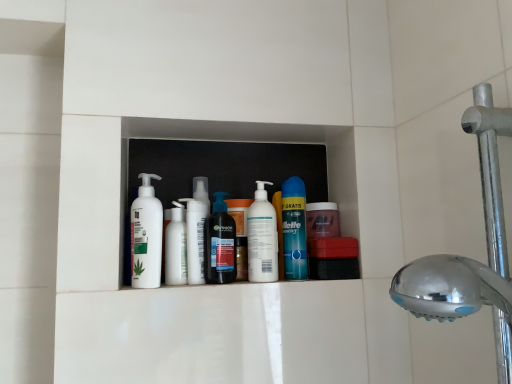
Describe the element at coordinates (262, 238) in the screenshot. I see `white matte pump bottle at center, acting as the 4th cleaning product starting from the left` at that location.

Image resolution: width=512 pixels, height=384 pixels. What are the coordinates of `white matte pump bottle at center, which is counted as the 2th cleaning product, starting from the right` in the screenshot? It's located at (262, 238).

The width and height of the screenshot is (512, 384). What do you see at coordinates (176, 247) in the screenshot? I see `white glossy lotion at center` at bounding box center [176, 247].

Describe the element at coordinates (195, 240) in the screenshot. I see `white matte bottle at center, the fourth cleaning product from the right` at that location.

Locate an element on the screen. chrome metallic shower head at right is located at coordinates pyautogui.click(x=465, y=257).

Locate an element on the screen. The height and width of the screenshot is (384, 512). white matte lotion at center, acting as the first cleaning product starting from the left is located at coordinates (146, 236).

The height and width of the screenshot is (384, 512). Identify the location of cleaning product that is the 4th one when counting upward from the white glossy lotion at center (from the image's perspective). (294, 229).

From the image's perspective, is white glossy lotion at center above blue glossy can at center, marked as the 1th cleaning product in a right-to-left arrangement?

Incorrect, from the image's perspective, white glossy lotion at center is lower than blue glossy can at center, marked as the 1th cleaning product in a right-to-left arrangement.

Could you tell me if white glossy lotion at center is facing blue glossy can at center, which ranks as the fifth cleaning product in left-to-right order?

No.

Considering the relative sizes of white matte lotion at center, acting as the first cleaning product starting from the left, and white glossy lotion at center in the image provided, is white matte lotion at center, acting as the first cleaning product starting from the left, smaller than white glossy lotion at center?

No, white matte lotion at center, acting as the first cleaning product starting from the left, is not smaller than white glossy lotion at center.

Which of these two, white matte lotion at center, acting as the 5th cleaning product starting from the right, or white glossy lotion at center, stands taller?

white matte lotion at center, acting as the 5th cleaning product starting from the right.

Which object is thinner, white matte lotion at center, acting as the first cleaning product starting from the left, or white glossy lotion at center?

Thinner between the two is white glossy lotion at center.

Are blue glossy can at center, which ranks as the fifth cleaning product in left-to-right order, and white matte bottle at center, the fourth cleaning product from the right, making contact?

No, blue glossy can at center, which ranks as the fifth cleaning product in left-to-right order, is not with white matte bottle at center, the fourth cleaning product from the right.

From the image's perspective, starting from the blue glossy can at center, marked as the 1th cleaning product in a right-to-left arrangement, which cleaning product is the 3rd one below? Please provide its 2D coordinates.

[(195, 240)]

Does blue glossy can at center, marked as the 1th cleaning product in a right-to-left arrangement, have a greater height compared to white matte bottle at center, positioned as the 2th cleaning product in left-to-right order?

Correct, blue glossy can at center, marked as the 1th cleaning product in a right-to-left arrangement, is much taller as white matte bottle at center, positioned as the 2th cleaning product in left-to-right order.

Is white glossy lotion at center to the left or to the right of white matte lotion at center, acting as the first cleaning product starting from the left, in the image?

In the image, white glossy lotion at center appears on the right side of white matte lotion at center, acting as the first cleaning product starting from the left.

From the image's perspective, which is above, white glossy lotion at center or white matte lotion at center, acting as the first cleaning product starting from the left?

From the image's view, white matte lotion at center, acting as the first cleaning product starting from the left, is above.

From a real-world perspective, is white glossy lotion at center physically located above or below white matte lotion at center, acting as the first cleaning product starting from the left?

In terms of real-world spatial position, white glossy lotion at center is below white matte lotion at center, acting as the first cleaning product starting from the left.

From the image's perspective, between blue glossy can at center, marked as the 1th cleaning product in a right-to-left arrangement, and white matte lotion at center, acting as the first cleaning product starting from the left, who is located below?

blue glossy can at center, marked as the 1th cleaning product in a right-to-left arrangement, is shown below in the image.

Does blue glossy can at center, marked as the 1th cleaning product in a right-to-left arrangement, lie behind white matte lotion at center, acting as the first cleaning product starting from the left?

Yes, blue glossy can at center, marked as the 1th cleaning product in a right-to-left arrangement, is behind white matte lotion at center, acting as the first cleaning product starting from the left.

From the white matte lotion at center, acting as the first cleaning product starting from the left, count 4th cleaning products backward and point to it. Please provide its 2D coordinates.

[(294, 229)]

Which of these two, blue glossy can at center, marked as the 1th cleaning product in a right-to-left arrangement, or white matte lotion at center, acting as the first cleaning product starting from the left, is thinner?

With smaller width is blue glossy can at center, marked as the 1th cleaning product in a right-to-left arrangement.

Is white matte bottle at center, the fourth cleaning product from the right, at the left side of blue glossy can at center, which ranks as the fifth cleaning product in left-to-right order?

Correct, you'll find white matte bottle at center, the fourth cleaning product from the right, to the left of blue glossy can at center, which ranks as the fifth cleaning product in left-to-right order.

Is white matte bottle at center, the fourth cleaning product from the right, turned away from blue glossy can at center, which ranks as the fifth cleaning product in left-to-right order?

No, white matte bottle at center, the fourth cleaning product from the right, is not facing the opposite direction of blue glossy can at center, which ranks as the fifth cleaning product in left-to-right order.

Identify the location of the 3rd cleaning product below the blue glossy can at center, marked as the 1th cleaning product in a right-to-left arrangement (from a real-world perspective). This screenshot has height=384, width=512. (195, 240).

From a real-world perspective, is white matte bottle at center, positioned as the 2th cleaning product in left-to-right order, on blue glossy can at center, marked as the 1th cleaning product in a right-to-left arrangement?

No, from a real-world perspective, white matte bottle at center, positioned as the 2th cleaning product in left-to-right order, is not above blue glossy can at center, marked as the 1th cleaning product in a right-to-left arrangement.

How many degrees apart are the facing directions of translucent plastic bottle at center, which is the 3th cleaning product in right-to-left order, and white matte lotion at center, acting as the 5th cleaning product starting from the right?

There is a 4.24-degree angle between the facing directions of translucent plastic bottle at center, which is the 3th cleaning product in right-to-left order, and white matte lotion at center, acting as the 5th cleaning product starting from the right.

Does translucent plastic bottle at center, which is the 3th cleaning product in right-to-left order, have a lesser height compared to white matte lotion at center, acting as the first cleaning product starting from the left?

Indeed, translucent plastic bottle at center, which is the 3th cleaning product in right-to-left order, has a lesser height compared to white matte lotion at center, acting as the first cleaning product starting from the left.

Does translucent plastic bottle at center, which is the 3th cleaning product in right-to-left order, have a lesser width compared to white matte lotion at center, acting as the 5th cleaning product starting from the right?

Correct, the width of translucent plastic bottle at center, which is the 3th cleaning product in right-to-left order, is less than that of white matte lotion at center, acting as the 5th cleaning product starting from the right.

Is translucent plastic bottle at center, which is the 3th cleaning product in right-to-left order, oriented towards white matte lotion at center, acting as the 5th cleaning product starting from the right?

No, translucent plastic bottle at center, which is the 3th cleaning product in right-to-left order, does not turn towards white matte lotion at center, acting as the 5th cleaning product starting from the right.

From the image's perspective, count 4th cleaning products upward from the white glossy lotion at center and point to it. Please provide its 2D coordinates.

[(294, 229)]

The height and width of the screenshot is (384, 512). I want to click on the 4th cleaning product in front of the white glossy lotion at center, so tap(146, 236).

Based on their spatial positions, is chrome metallic shower head at right or blue glossy can at center, marked as the 1th cleaning product in a right-to-left arrangement, further from white matte pump bottle at center, which is counted as the 2th cleaning product, starting from the right?

Among the two, chrome metallic shower head at right is located further to white matte pump bottle at center, which is counted as the 2th cleaning product, starting from the right.

Estimate the real-world distances between objects in this image. Which object is closer to white matte bottle at center, positioned as the 2th cleaning product in left-to-right order, translucent plastic bottle at center, marked as the 3th cleaning product in a left-to-right arrangement, or blue glossy can at center, which ranks as the fifth cleaning product in left-to-right order?

The object closer to white matte bottle at center, positioned as the 2th cleaning product in left-to-right order, is translucent plastic bottle at center, marked as the 3th cleaning product in a left-to-right arrangement.

Based on their spatial positions, is white matte lotion at center, acting as the 5th cleaning product starting from the right, or blue glossy can at center, which ranks as the fifth cleaning product in left-to-right order, further from white matte bottle at center, the fourth cleaning product from the right?

blue glossy can at center, which ranks as the fifth cleaning product in left-to-right order.

From the image, which object appears to be nearer to white matte lotion at center, acting as the 5th cleaning product starting from the right, white matte pump bottle at center, which is counted as the 2th cleaning product, starting from the right, or white matte bottle at center, the fourth cleaning product from the right?

white matte bottle at center, the fourth cleaning product from the right, is closer to white matte lotion at center, acting as the 5th cleaning product starting from the right.

From the image, which object appears to be nearer to blue glossy can at center, marked as the 1th cleaning product in a right-to-left arrangement, white matte pump bottle at center, acting as the 4th cleaning product starting from the left, or white glossy lotion at center?

white matte pump bottle at center, acting as the 4th cleaning product starting from the left, is closer to blue glossy can at center, marked as the 1th cleaning product in a right-to-left arrangement.

Estimate the real-world distances between objects in this image. Which object is closer to white matte lotion at center, acting as the 5th cleaning product starting from the right, white matte bottle at center, the fourth cleaning product from the right, or blue glossy can at center, which ranks as the fifth cleaning product in left-to-right order?

The object closer to white matte lotion at center, acting as the 5th cleaning product starting from the right, is white matte bottle at center, the fourth cleaning product from the right.

In the scene shown: Considering their positions, is white matte lotion at center, acting as the 5th cleaning product starting from the right, positioned closer to translucent plastic bottle at center, marked as the 3th cleaning product in a left-to-right arrangement, than blue glossy can at center, which ranks as the fifth cleaning product in left-to-right order?

white matte lotion at center, acting as the 5th cleaning product starting from the right, is positioned closer to the anchor translucent plastic bottle at center, marked as the 3th cleaning product in a left-to-right arrangement.

When comparing their distances from chrome metallic shower head at right, does blue glossy can at center, marked as the 1th cleaning product in a right-to-left arrangement, or white glossy lotion at center seem closer?

blue glossy can at center, marked as the 1th cleaning product in a right-to-left arrangement, is positioned closer to the anchor chrome metallic shower head at right.

You are a GUI agent. You are given a task and a screenshot of the screen. Output one action in this format:
    pyautogui.click(x=<x>, y=<y>)
    Task: Click on the cleaning product between translucent plastic bottle at center, which is the 3th cleaning product in right-to-left order, and blue glossy can at center, which ranks as the fifth cleaning product in left-to-right order
    
    Given the screenshot: What is the action you would take?
    pyautogui.click(x=262, y=238)

This screenshot has width=512, height=384. Find the location of `toiletry situated between white matte lotion at center, acting as the 5th cleaning product starting from the right, and white matte bottle at center, positioned as the 2th cleaning product in left-to-right order, from left to right`. toiletry situated between white matte lotion at center, acting as the 5th cleaning product starting from the right, and white matte bottle at center, positioned as the 2th cleaning product in left-to-right order, from left to right is located at coordinates (176, 247).

Locate an element on the screen. This screenshot has height=384, width=512. cleaning product located between white glossy lotion at center and translucent plastic bottle at center, marked as the 3th cleaning product in a left-to-right arrangement, in the left-right direction is located at coordinates point(195,240).

Find the location of `toiletry between white matte lotion at center, acting as the 5th cleaning product starting from the right, and white matte pump bottle at center, acting as the 4th cleaning product starting from the left, from left to right`. toiletry between white matte lotion at center, acting as the 5th cleaning product starting from the right, and white matte pump bottle at center, acting as the 4th cleaning product starting from the left, from left to right is located at coordinates (176, 247).